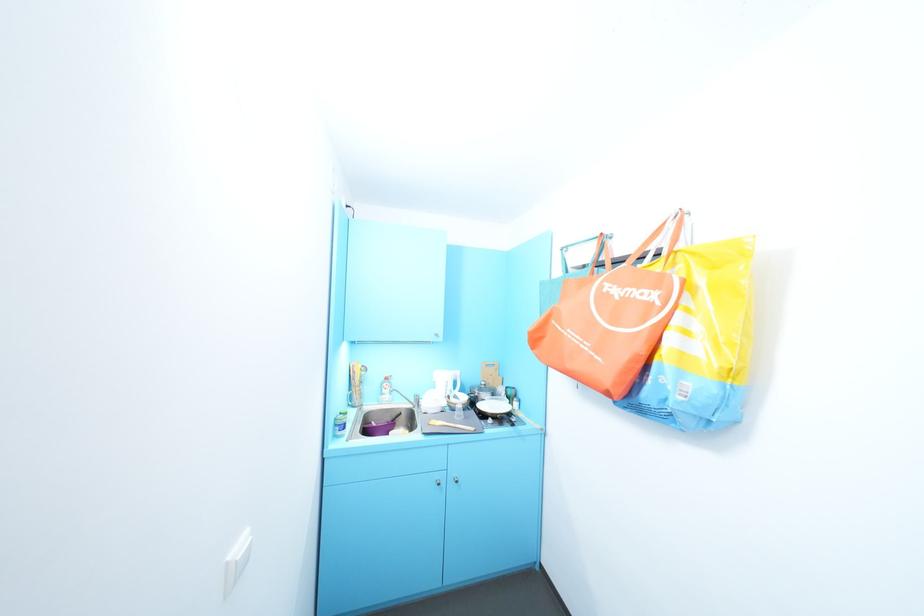
Locate an element on the screen. This screenshot has height=616, width=924. white light switch is located at coordinates (235, 565).